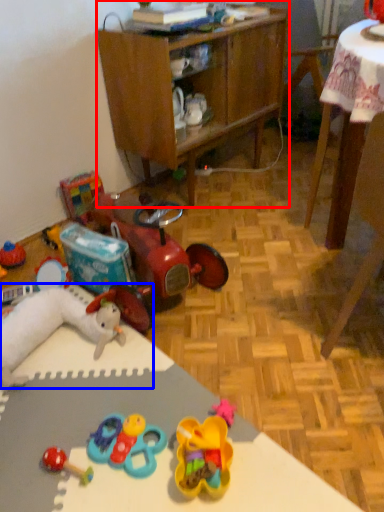
Question: Which object is further to the camera taking this photo, cabinetry (highlighted by a red box) or toy (highlighted by a blue box)?

Choices:
 (A) cabinetry
 (B) toy

Answer: (A)